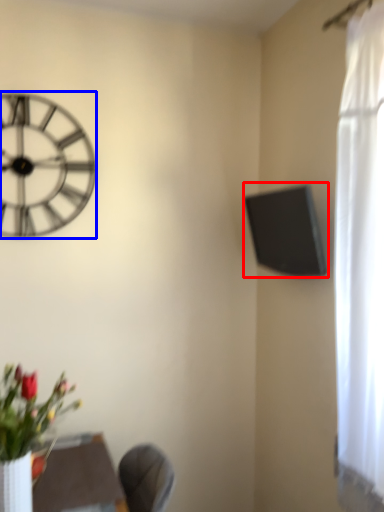
Question: Which of the following is the farthest to the observer, window screen (highlighted by a red box) or wall clock (highlighted by a blue box)?

Choices:
 (A) window screen
 (B) wall clock

Answer: (B)